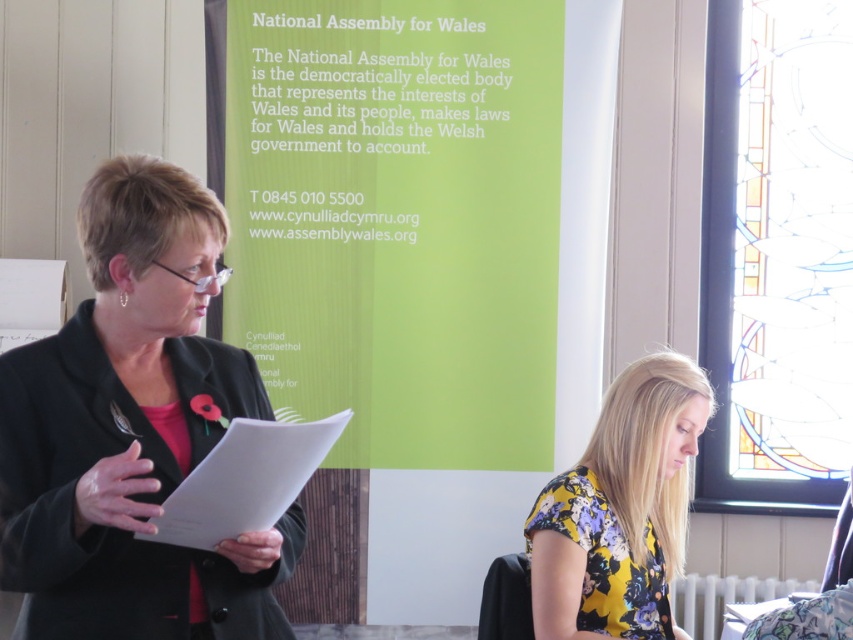
Does black matte blazer at left appear on the right side of white paper clipboard at center?

In fact, black matte blazer at left is to the left of white paper clipboard at center.

Can you confirm if black matte blazer at left is bigger than white paper clipboard at center?

Yes, black matte blazer at left is bigger than white paper clipboard at center.

Is point (86, 604) in front of point (251, 445)?

That is False.

This screenshot has height=640, width=853. Identify the location of black matte blazer at left. (132, 432).

Measure the distance between black matte blazer at left and floral fabric blouse at lower center.

black matte blazer at left and floral fabric blouse at lower center are 79.72 centimeters apart.

Based on the photo, can you confirm if black matte blazer at left is positioned below floral fabric blouse at lower center?

No, black matte blazer at left is not below floral fabric blouse at lower center.

Between point (166, 288) and point (556, 609), which one is positioned behind?

The point (556, 609) is more distant.

Identify the location of black matte blazer at left. (132, 432).

Does floral fabric blouse at lower center have a lesser height compared to white paper clipboard at center?

In fact, floral fabric blouse at lower center may be taller than white paper clipboard at center.

Does floral fabric blouse at lower center have a larger size compared to white paper clipboard at center?

Correct, floral fabric blouse at lower center is larger in size than white paper clipboard at center.

Is point (593, 461) positioned after point (199, 486)?

Yes, point (593, 461) is farther from viewer.

I want to click on floral fabric blouse at lower center, so point(619,509).